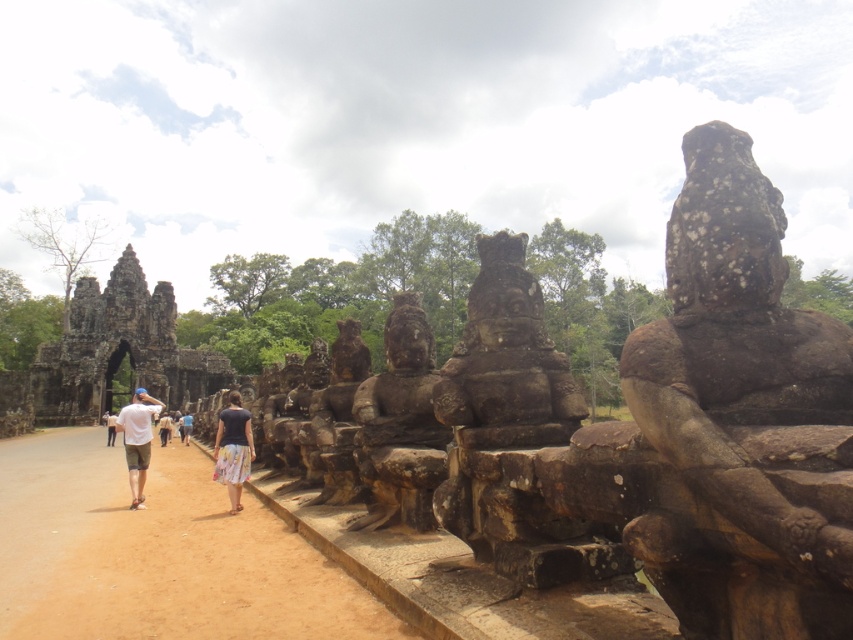
You are standing at the entrance of the temple complex and want to reach the point marked at coordinates (520, 326). If your walking speed is 1.5 meters per second, how long will it take you to reach that point?

The distance between you and the point marked at coordinates (520, 326) is 26.57 meters. At a walking speed of 1.5 meters per second, it will take approximately 17.71 seconds to reach the point.

You are standing at the center of the historical site and see the point marked at coordinates (x=506, y=360). What does this point indicate?

The point at coordinates (x=506, y=360) indicates a rough stone statue at center.